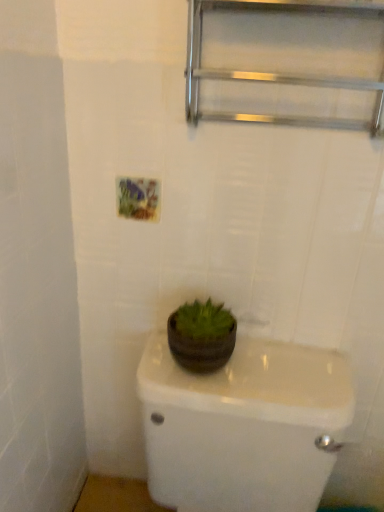
Question: Should I look upward or downward to see metallic silver shelf at upper center?

Choices:
 (A) up
 (B) down

Answer: (A)

Question: Can you confirm if matte brown pot at center is taller than dark brown matte flowerpot at center?

Choices:
 (A) no
 (B) yes

Answer: (B)

Question: Is matte brown pot at center positioned far away from dark brown matte flowerpot at center?

Choices:
 (A) yes
 (B) no

Answer: (B)

Question: From the image's perspective, is matte brown pot at center above dark brown matte flowerpot at center?

Choices:
 (A) yes
 (B) no

Answer: (B)

Question: Would you say matte brown pot at center is outside dark brown matte flowerpot at center?

Choices:
 (A) no
 (B) yes

Answer: (B)

Question: Is matte brown pot at center next to dark brown matte flowerpot at center?

Choices:
 (A) no
 (B) yes

Answer: (A)

Question: Is matte brown pot at center wider than dark brown matte flowerpot at center?

Choices:
 (A) no
 (B) yes

Answer: (B)

Question: Does metallic silver shelf at upper center have a smaller size compared to matte brown pot at center?

Choices:
 (A) no
 (B) yes

Answer: (B)

Question: Is metallic silver shelf at upper center further to the viewer compared to matte brown pot at center?

Choices:
 (A) no
 (B) yes

Answer: (B)

Question: Is metallic silver shelf at upper center looking in the opposite direction of matte brown pot at center?

Choices:
 (A) no
 (B) yes

Answer: (A)

Question: From the image's perspective, is metallic silver shelf at upper center on top of matte brown pot at center?

Choices:
 (A) no
 (B) yes

Answer: (B)

Question: Is metallic silver shelf at upper center taller than matte brown pot at center?

Choices:
 (A) yes
 (B) no

Answer: (B)

Question: From a real-world perspective, is metallic silver shelf at upper center over matte brown pot at center?

Choices:
 (A) yes
 (B) no

Answer: (A)

Question: Is matte brown pot at center at the back of dark brown matte flowerpot at center?

Choices:
 (A) yes
 (B) no

Answer: (B)